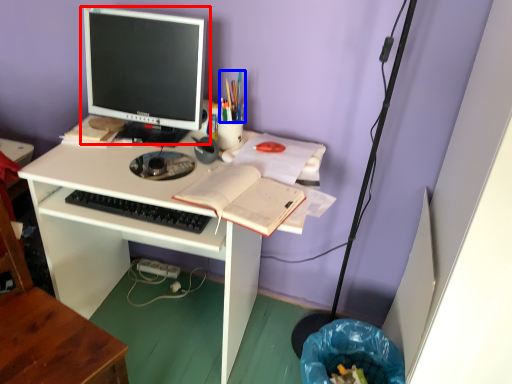
Question: Which point is closer to the camera, computer monitor (highlighted by a red box) or stationery (highlighted by a blue box)?

Choices:
 (A) computer monitor
 (B) stationery

Answer: (A)